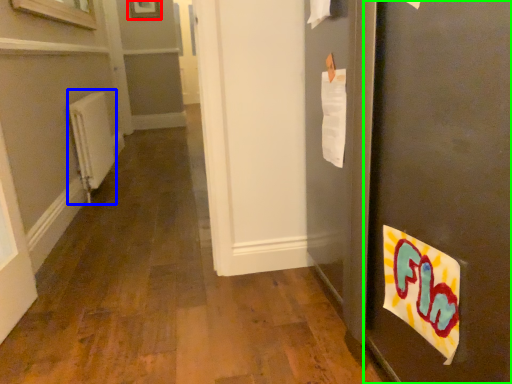
Question: Which object is positioned farthest from picture frame (highlighted by a red box)? Select from radiator (highlighted by a blue box) and door (highlighted by a green box).

Choices:
 (A) radiator
 (B) door

Answer: (B)